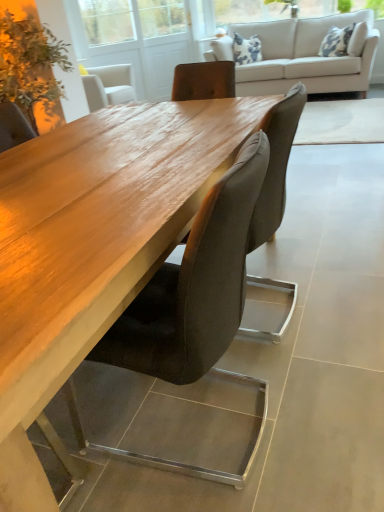
Question: From their relative heights in the image, would you say beige fabric couch at upper center is taller or shorter than transparent glass screen door at upper center?

Choices:
 (A) short
 (B) tall

Answer: (A)

Question: Is point (281, 28) positioned closer to the camera than point (104, 57)?

Choices:
 (A) farther
 (B) closer

Answer: (A)

Question: Estimate the real-world distances between objects in this image. Which object is farther from the green leafy plant at upper left?

Choices:
 (A) transparent glass screen door at upper center
 (B) suede-like brown chair at center, arranged as the second chair when viewed from the front
 (C) suede-like brown chair at center, arranged as the 2th chair when viewed from the back
 (D) beige fabric couch at upper center

Answer: (C)

Question: Which is nearer to the beige fabric couch at upper center?

Choices:
 (A) suede-like brown chair at center, marked as the first chair in a back-to-front arrangement
 (B) transparent glass screen door at upper center
 (C) green leafy plant at upper left
 (D) suede-like brown chair at center, arranged as the 2th chair when viewed from the back

Answer: (B)